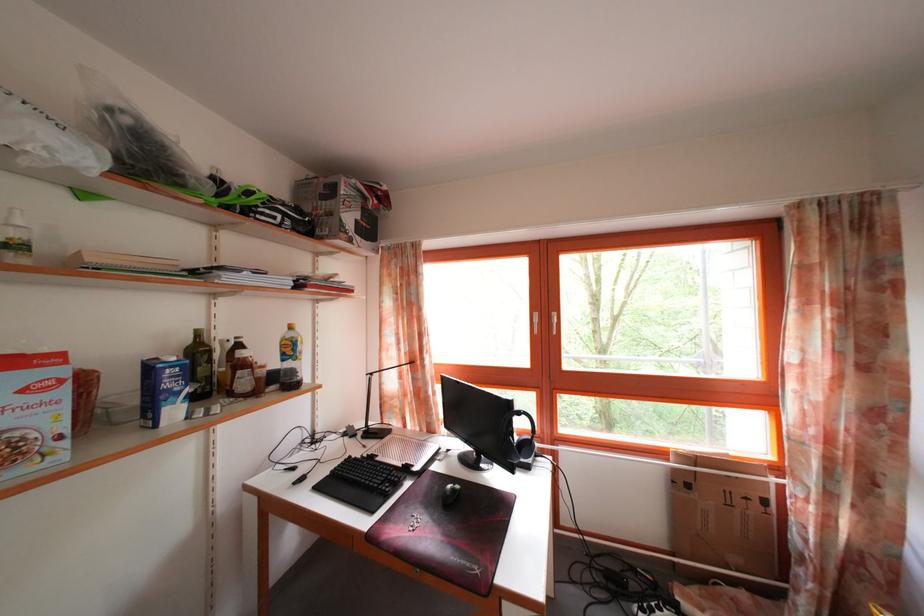
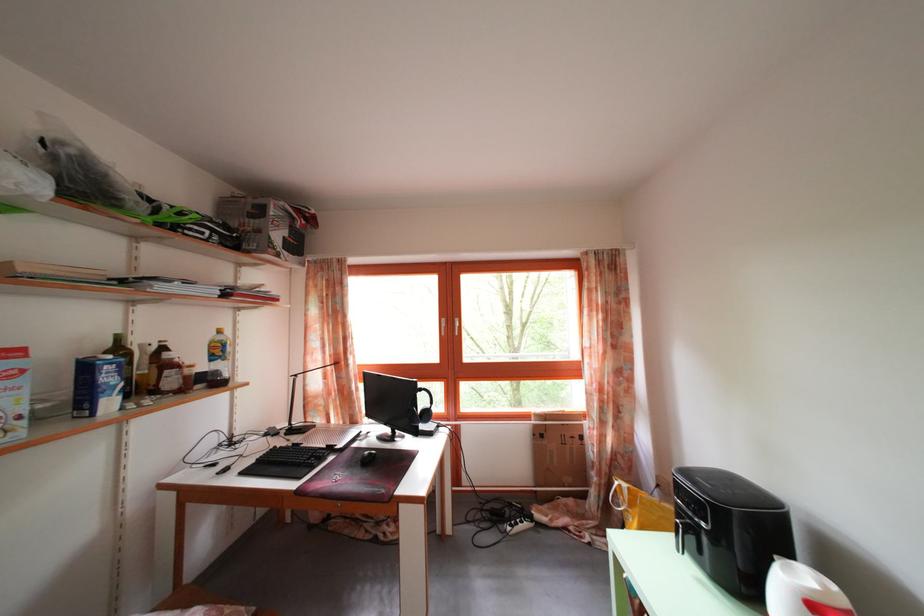
Locate, in the second image, the point that corresponds to pixel 684 477 in the first image.

(542, 432)